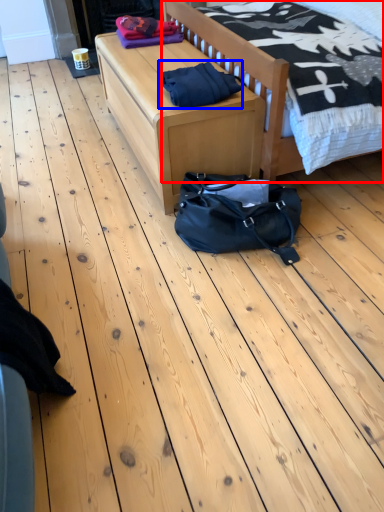
Question: Among these objects, which one is nearest to the camera, bed (highlighted by a red box) or material (highlighted by a blue box)?

Choices:
 (A) bed
 (B) material

Answer: (A)